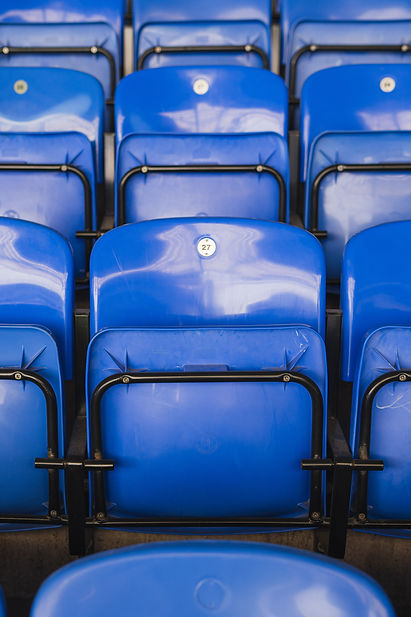
Where is `seats`? The image size is (411, 617). seats is located at coordinates (223, 595), (33, 265), (191, 254), (379, 268), (384, 109), (192, 102), (47, 102), (73, 10), (204, 7), (352, 17).